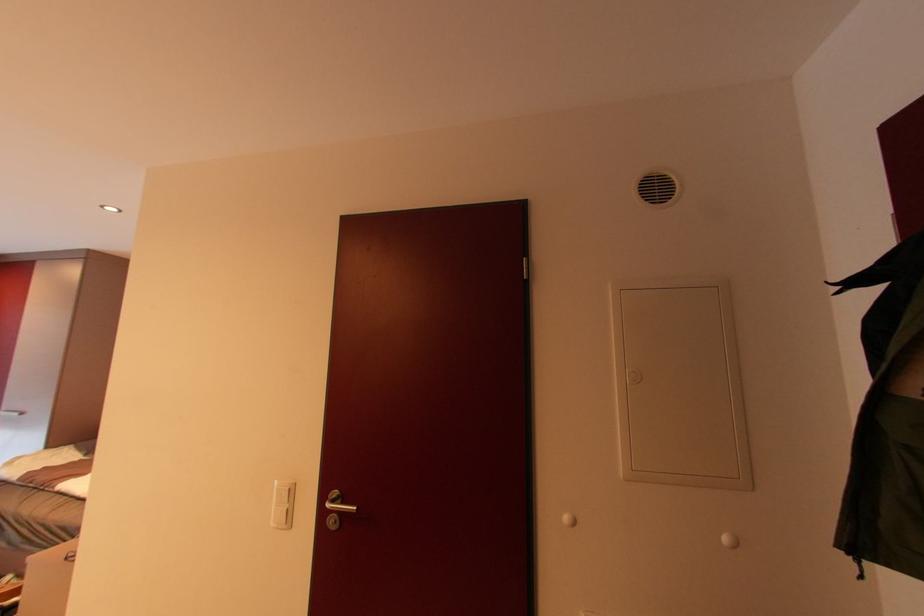
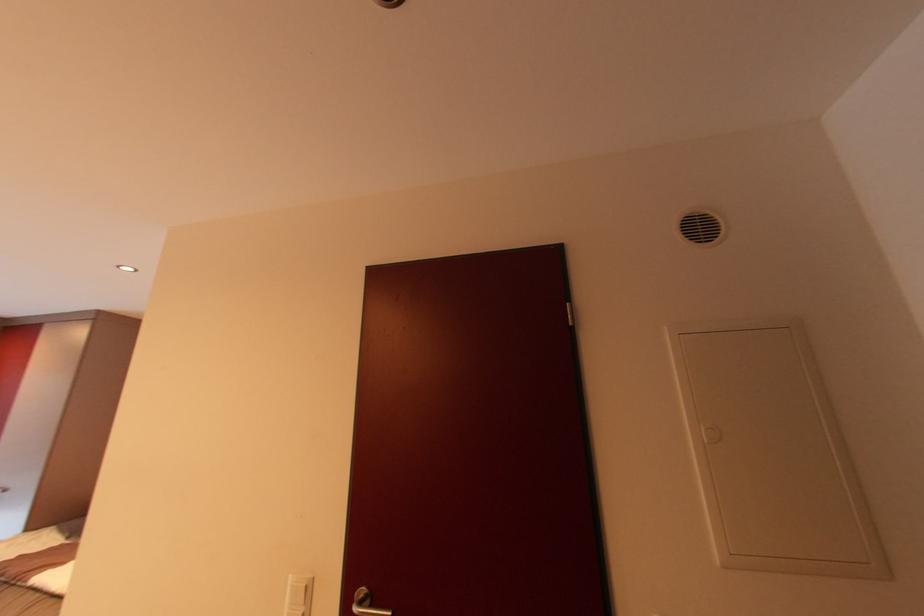
Question: Based on the continuous images, in which direction is the camera rotating? Reply with the corresponding letter.

Choices:
 (A) Left
 (B) Right
 (C) Up
 (D) Down

Answer: (C)